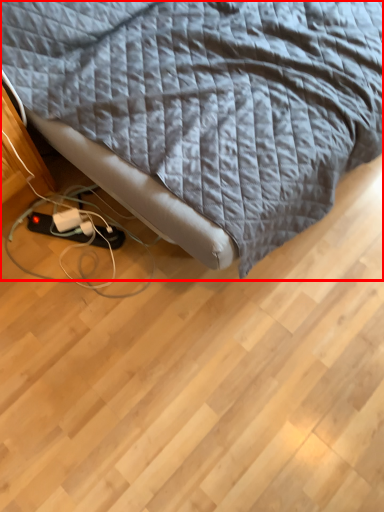
Question: In this image, where is bed (annotated by the red box) located relative to extension cord?

Choices:
 (A) left
 (B) right

Answer: (B)